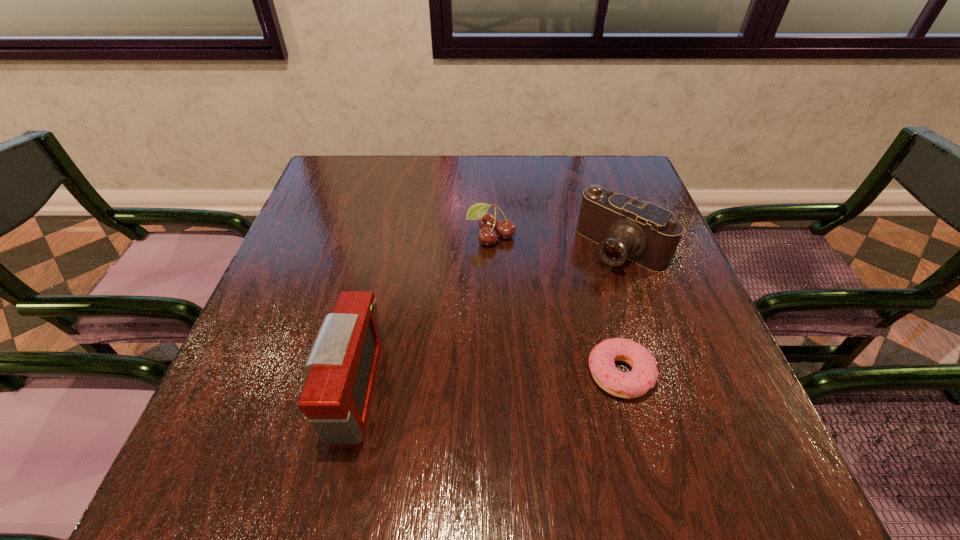
Where is `vacant space on the desktop that is between the left camera and the shortest object and is positioned on the leaves of the second shortest object`? The image size is (960, 540). vacant space on the desktop that is between the left camera and the shortest object and is positioned on the leaves of the second shortest object is located at coordinates click(x=501, y=381).

Where is `vacant space on the desktop that is between the nearer camera and the doughnut and is positioned on the front-facing side of the shorter camera`? This screenshot has width=960, height=540. vacant space on the desktop that is between the nearer camera and the doughnut and is positioned on the front-facing side of the shorter camera is located at coordinates (483, 382).